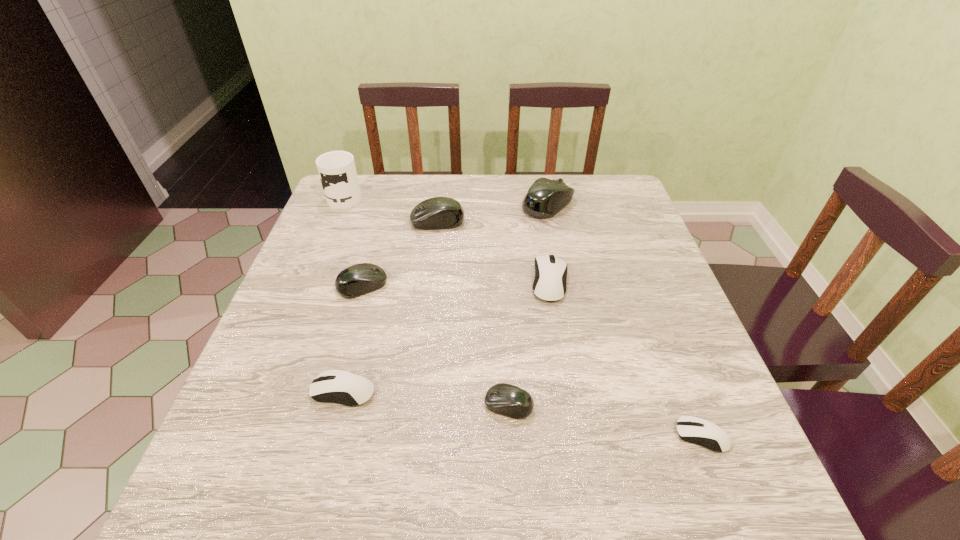
At what (x,y) coordinates should I click in order to perform the action: click on the leftmost white mouse. Please return your answer as a coordinate pair (x, y). Looking at the image, I should click on (355, 389).

At what (x,y) coordinates should I click in order to perform the action: click on the second smallest white mouse. Please return your answer as a coordinate pair (x, y). This screenshot has height=540, width=960. Looking at the image, I should click on (355, 389).

This screenshot has width=960, height=540. I want to click on the nearest black mouse, so click(505, 399).

I want to click on the smallest black mouse, so click(505, 399).

Where is `the rightmost object`? the rightmost object is located at coordinates (692, 429).

The height and width of the screenshot is (540, 960). I want to click on the shortest object, so point(692,429).

I want to click on vacant space located on the front of the rightmost black mouse, so click(x=562, y=271).

The width and height of the screenshot is (960, 540). In order to click on vacant space positioned on the back of the fifth object from right to left in this screenshot , I will do `click(442, 186)`.

Locate an element on the screen. This screenshot has height=540, width=960. free spot located 0.110m on the left of the biggest white mouse is located at coordinates (485, 282).

Image resolution: width=960 pixels, height=540 pixels. Find the location of `vacant space located 0.270m on the right of the third biggest black mouse`. vacant space located 0.270m on the right of the third biggest black mouse is located at coordinates (501, 286).